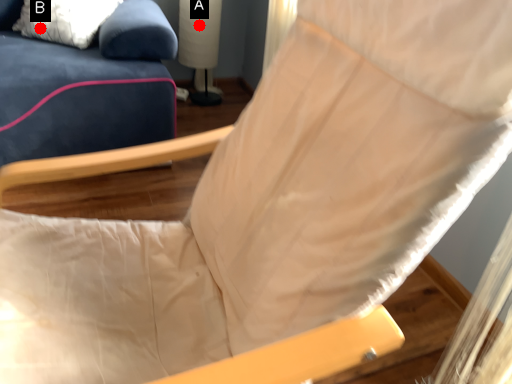
Question: Two points are circled on the image, labeled by A and B beside each circle. Among these points, which one is nearest to the camera?

Choices:
 (A) A is closer
 (B) B is closer

Answer: (B)